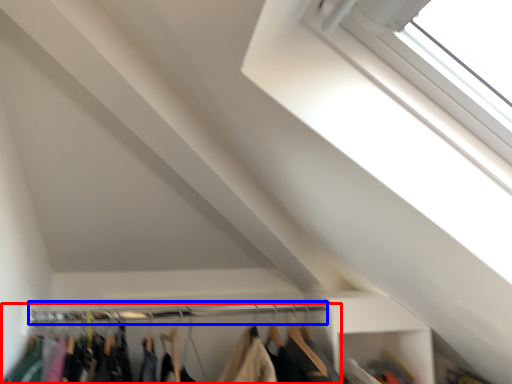
Question: Which of the following is the farthest to the observer, closet (highlighted by a red box) or clothesline (highlighted by a blue box)?

Choices:
 (A) closet
 (B) clothesline

Answer: (B)